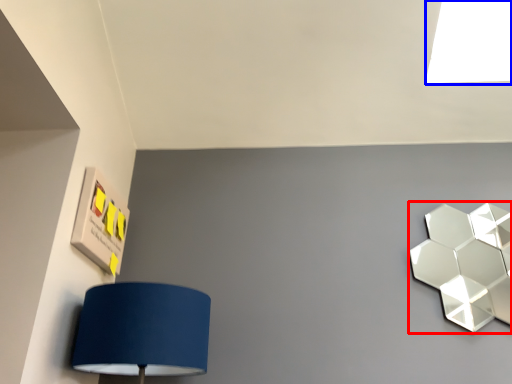
Question: Which of the following is the farthest to the observer, lamp (highlighted by a red box) or light (highlighted by a blue box)?

Choices:
 (A) lamp
 (B) light

Answer: (B)